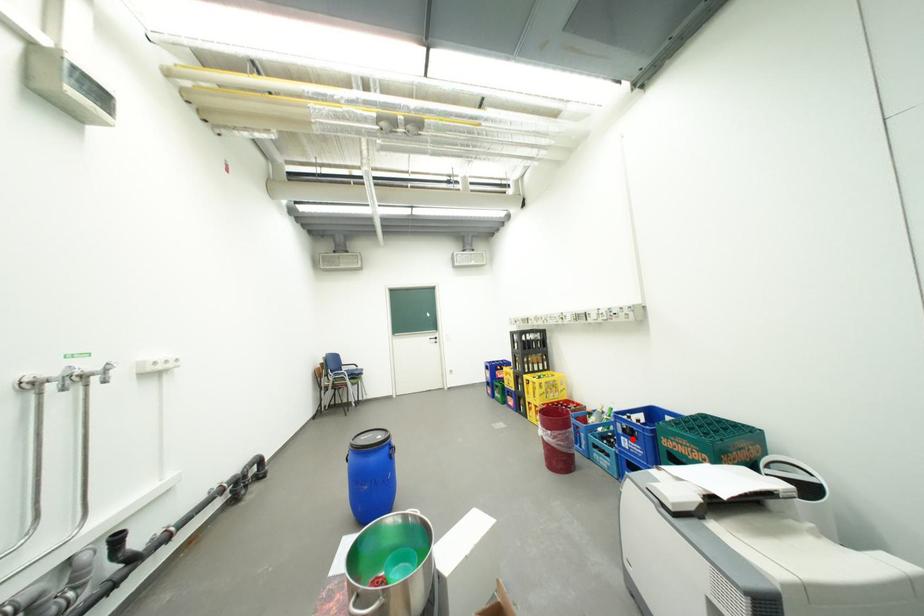
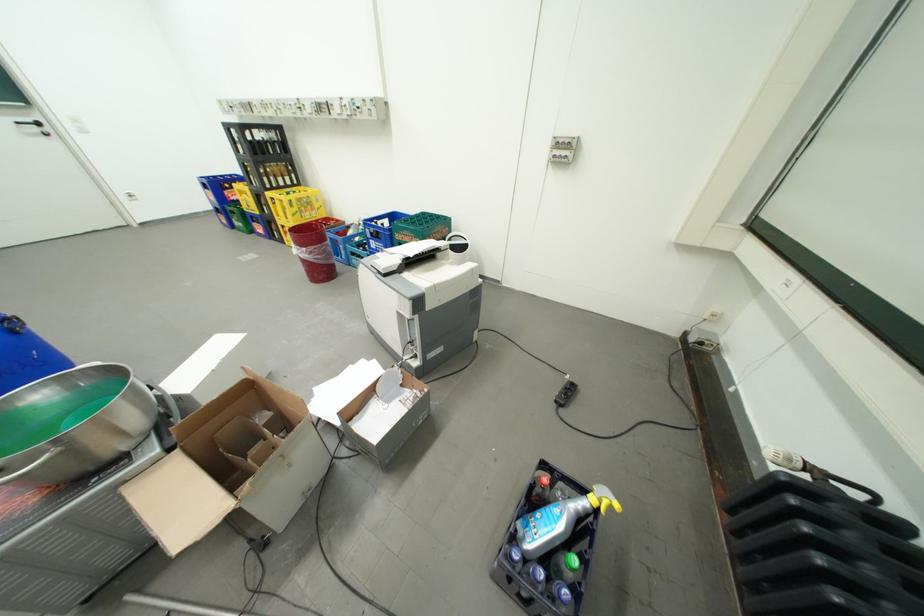
Question: I am providing you with two images of the same scene from different viewpoints. In image1, a red point is highlighted. Considering the same 3D point in image2, which of the following is correct?

Choices:
 (A) It is closer
 (B) It is farther

Answer: (B)